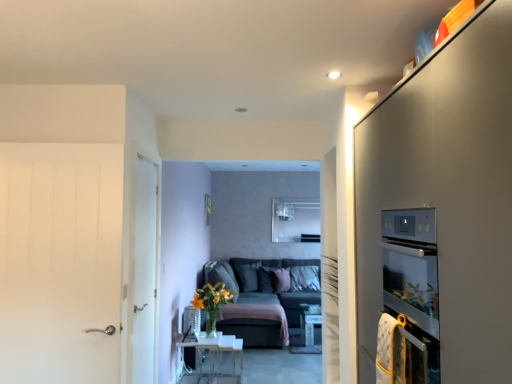
Question: Is velvet dark gray pillow at center, which appears as the 3th pillow when viewed from the right, positioned in front of white wood door at left, the first door from the right?

Choices:
 (A) no
 (B) yes

Answer: (A)

Question: Can you confirm if velvet dark gray pillow at center, which appears as the 3th pillow when viewed from the right, is shorter than white wood door at left, marked as the first door in a back-to-front arrangement?

Choices:
 (A) yes
 (B) no

Answer: (A)

Question: Does velvet dark gray pillow at center, which appears as the 3th pillow when viewed from the right, have a greater width compared to white wood door at left, marked as the first door in a back-to-front arrangement?

Choices:
 (A) yes
 (B) no

Answer: (A)

Question: From the image's perspective, is velvet dark gray pillow at center, which appears as the 3th pillow when viewed from the right, beneath white wood door at left, marked as the first door in a back-to-front arrangement?

Choices:
 (A) no
 (B) yes

Answer: (B)

Question: From a real-world perspective, is velvet dark gray pillow at center, which appears as the 3th pillow when viewed from the right, located higher than white wood door at left, the second door viewed from the front?

Choices:
 (A) no
 (B) yes

Answer: (A)

Question: From the image's perspective, is white soft pillow at center, which ranks as the third pillow in left-to-right order, above or below pink fabric pillow at center, which is the second pillow in left-to-right order?

Choices:
 (A) below
 (B) above

Answer: (B)

Question: Considering the positions of white soft pillow at center, which ranks as the third pillow in left-to-right order, and pink fabric pillow at center, the 2th pillow in the right-to-left sequence, in the image, is white soft pillow at center, which ranks as the third pillow in left-to-right order, taller or shorter than pink fabric pillow at center, the 2th pillow in the right-to-left sequence,?

Choices:
 (A) tall
 (B) short

Answer: (A)

Question: Is point (309, 271) closer or farther from the camera than point (287, 274)?

Choices:
 (A) farther
 (B) closer

Answer: (B)

Question: Is white soft pillow at center, which ranks as the third pillow in left-to-right order, wider or thinner than pink fabric pillow at center, the 2th pillow in the right-to-left sequence?

Choices:
 (A) wide
 (B) thin

Answer: (A)

Question: Is pink fabric pillow at center, which is the second pillow in left-to-right order, inside or outside of clear glass table at lower center?

Choices:
 (A) inside
 (B) outside

Answer: (B)

Question: Would you say pink fabric pillow at center, which is the second pillow in left-to-right order, is to the left or to the right of clear glass table at lower center in the picture?

Choices:
 (A) right
 (B) left

Answer: (A)

Question: Looking at the image, does pink fabric pillow at center, the 2th pillow in the right-to-left sequence, seem bigger or smaller compared to clear glass table at lower center?

Choices:
 (A) big
 (B) small

Answer: (B)

Question: From the image's perspective, is pink fabric pillow at center, which is the second pillow in left-to-right order, positioned above or below clear glass table at lower center?

Choices:
 (A) above
 (B) below

Answer: (A)

Question: Considering the positions of point (284, 289) and point (318, 302), is point (284, 289) closer or farther from the camera than point (318, 302)?

Choices:
 (A) closer
 (B) farther

Answer: (B)

Question: From a real-world perspective, is pink fabric pillow at center, the 2th pillow in the right-to-left sequence, above or below dark gray fabric couch at center?

Choices:
 (A) below
 (B) above

Answer: (B)